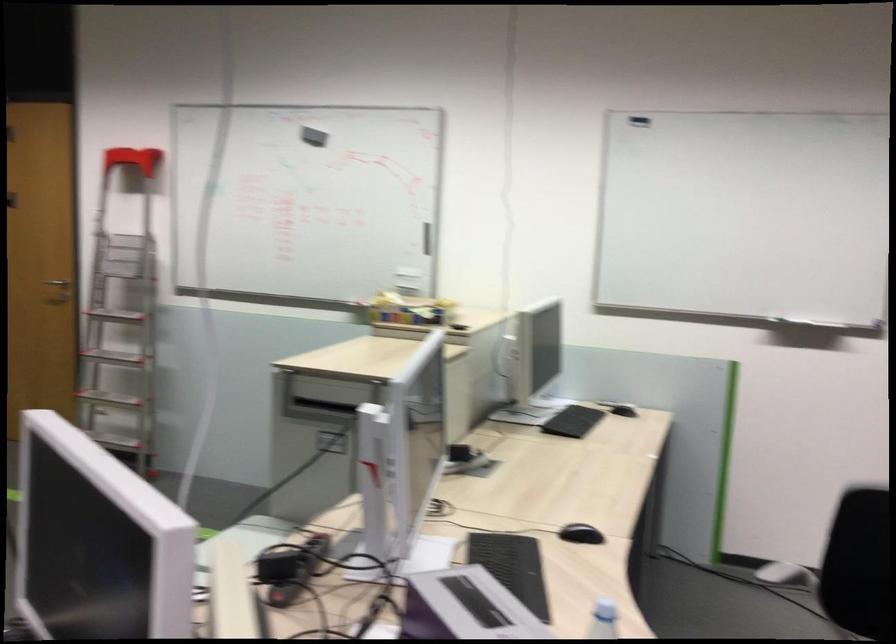
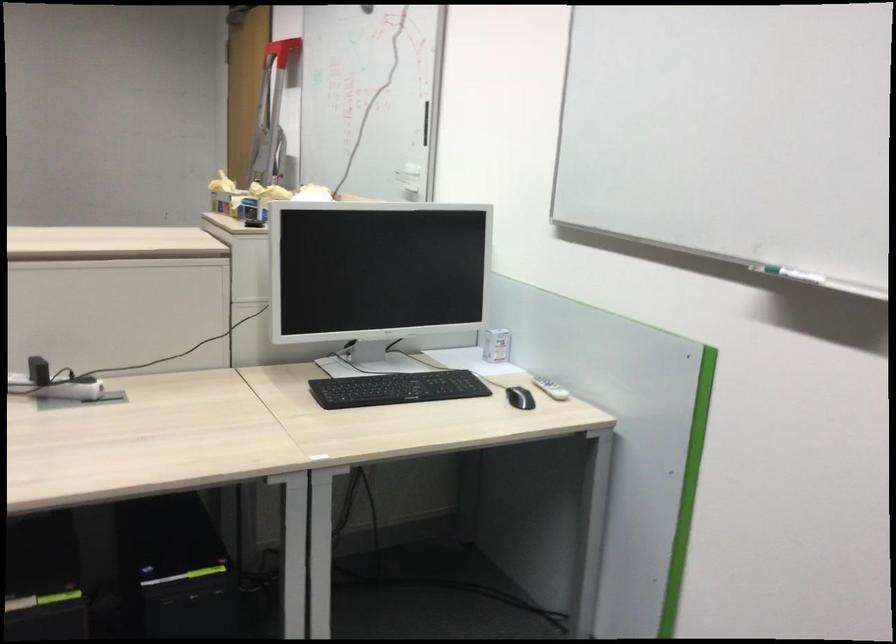
The point at (429,241) is marked in the first image. Where is the corresponding point in the second image?

(426, 122)